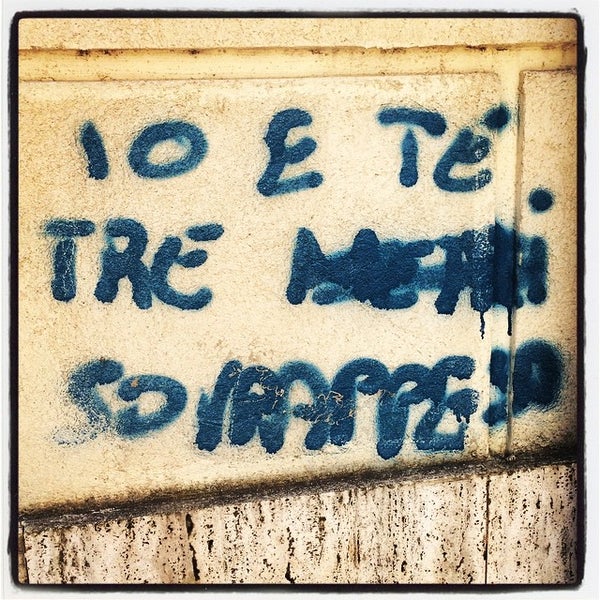
Find the location of a particular element. The height and width of the screenshot is (600, 600). light beige stain on wooden board is located at coordinates (278, 552), (503, 566).